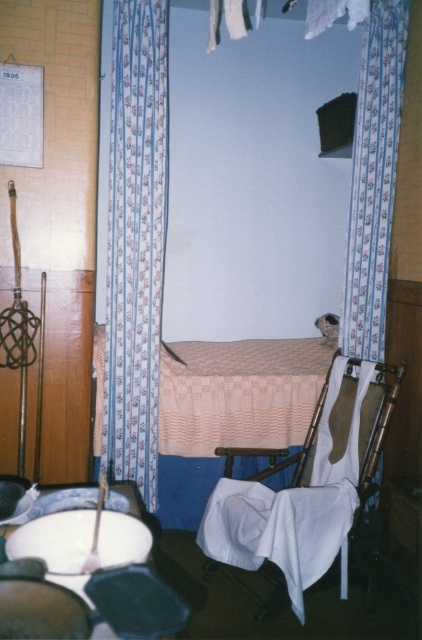
Does point (122, 209) come in front of point (379, 106)?

Yes, it is.

Which of these two, floral fabric curtain at left or floral fabric curtain at right, stands shorter?

floral fabric curtain at right is shorter.

Where is `floral fabric curtain at left`? The height and width of the screenshot is (640, 422). floral fabric curtain at left is located at coordinates [135, 241].

Is wooden rocking chair at center below beige woven blanket at center?

Correct, wooden rocking chair at center is located below beige woven blanket at center.

Who is more distant from viewer, [340,472] or [302,420]?

The point [302,420] is behind.

This screenshot has height=640, width=422. In order to click on wooden rocking chair at center in this screenshot , I will do `click(308, 486)`.

Between beige woven blanket at center and white glossy table at lower left, which one has more height?

Standing taller between the two is beige woven blanket at center.

Who is shorter, beige woven blanket at center or white glossy table at lower left?

With less height is white glossy table at lower left.

Which is behind, point (192, 456) or point (89, 608)?

Positioned behind is point (192, 456).

This screenshot has height=640, width=422. Find the location of `beige woven blanket at center`. beige woven blanket at center is located at coordinates (238, 394).